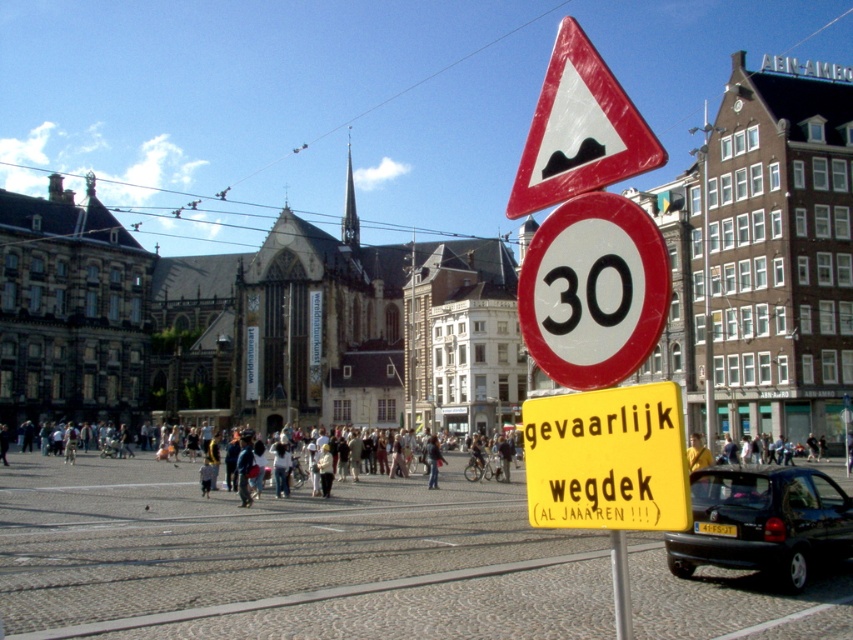
In the scene shown: Does white glossy speed limit sign at center have a lesser height compared to denim jacket at center?

No, white glossy speed limit sign at center is not shorter than denim jacket at center.

Is white glossy speed limit sign at center thinner than denim jacket at center?

No.

Describe the element at coordinates (593, 291) in the screenshot. I see `white glossy speed limit sign at center` at that location.

You are a GUI agent. You are given a task and a screenshot of the screen. Output one action in this format:
    pyautogui.click(x=<x>, y=<y>)
    Task: Click on the white glossy speed limit sign at center
    This screenshot has height=640, width=853.
    Given the screenshot: What is the action you would take?
    pyautogui.click(x=593, y=291)

Between point (618, 634) and point (434, 467), which one is positioned in front?

Point (618, 634) is in front.

You are a GUI agent. You are given a task and a screenshot of the screen. Output one action in this format:
    pyautogui.click(x=<x>, y=<y>)
    Task: Click on the metallic pole at center
    
    Given the screenshot: What is the action you would take?
    pyautogui.click(x=619, y=584)

This screenshot has height=640, width=853. Identify the location of metallic pole at center. (619, 584).

Between black matte car at lower right and metallic pole at center, which one is positioned lower?

metallic pole at center is lower down.

Is black matte car at lower right smaller than metallic pole at center?

Yes, black matte car at lower right is smaller than metallic pole at center.

The width and height of the screenshot is (853, 640). What are the coordinates of `black matte car at lower right` in the screenshot? It's located at (763, 522).

Image resolution: width=853 pixels, height=640 pixels. What are the coordinates of `black matte car at lower right` in the screenshot? It's located at (763, 522).